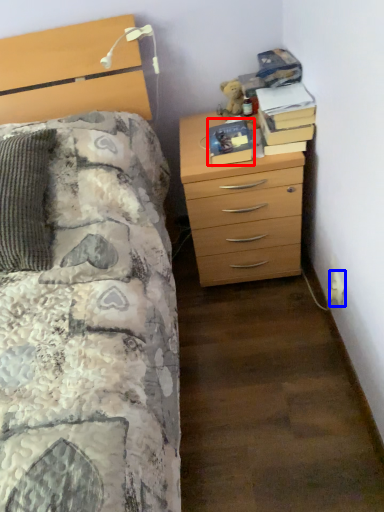
Question: Which object appears farthest to the camera in this image, book (highlighted by a red box) or electric outlet (highlighted by a blue box)?

Choices:
 (A) book
 (B) electric outlet

Answer: (A)